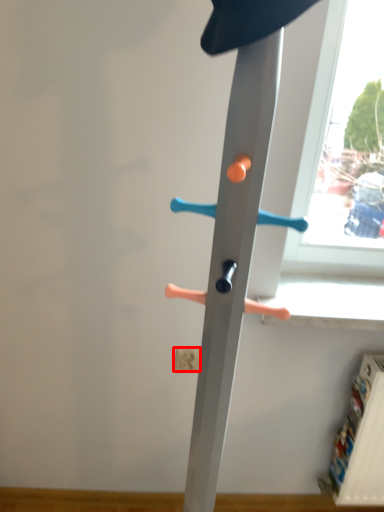
Question: From the image's perspective, where is electric outlet (annotated by the red box) located in relation to furniture in the image?

Choices:
 (A) below
 (B) above

Answer: (A)